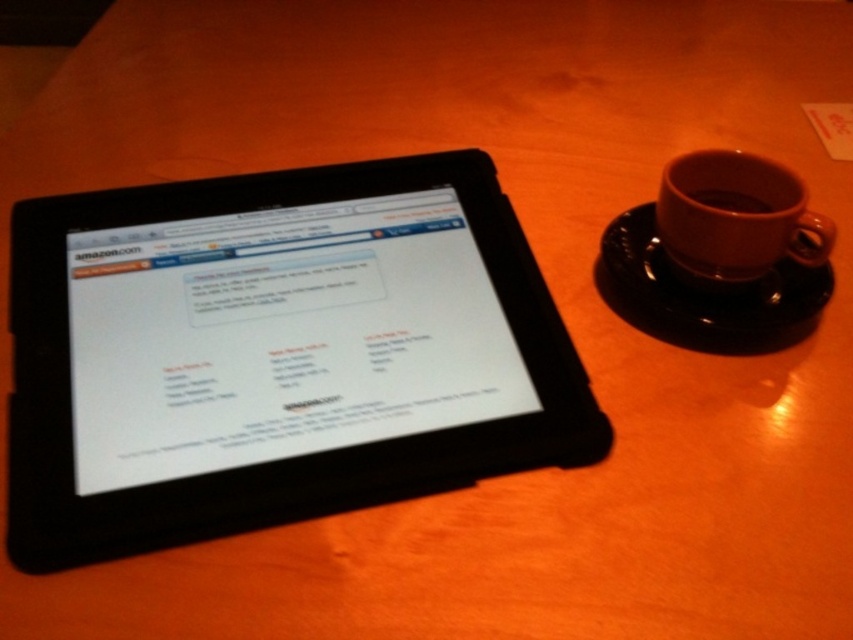
Can you confirm if black matte tablet at left is positioned to the right of brown ceramic mug at upper right?

No, black matte tablet at left is not to the right of brown ceramic mug at upper right.

Is black matte tablet at left above brown ceramic mug at upper right?

Actually, black matte tablet at left is below brown ceramic mug at upper right.

I want to click on black matte tablet at left, so pyautogui.click(x=276, y=353).

Based on the photo, who is positioned more to the right, black ceramic saucer at right or brown ceramic mug at upper right?

brown ceramic mug at upper right is more to the right.

Can you confirm if black ceramic saucer at right is thinner than brown ceramic mug at upper right?

Incorrect, black ceramic saucer at right's width is not less than brown ceramic mug at upper right's.

Is point (755, 316) in front of point (827, 234)?

No, (755, 316) is behind (827, 234).

Identify the location of black ceramic saucer at right. (704, 292).

Does black matte tablet at left have a greater width compared to brown matte cup at right?

Yes.

Find the location of `black matte tablet at left`. black matte tablet at left is located at coordinates (276, 353).

I want to click on black matte tablet at left, so click(276, 353).